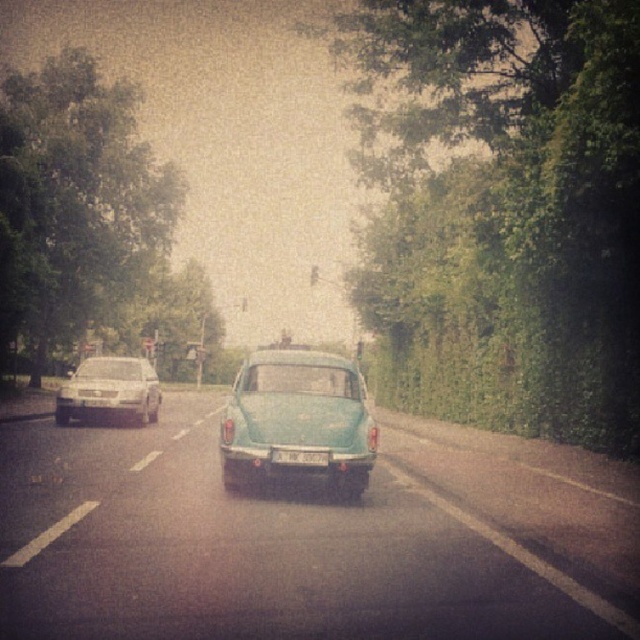
You are a delivery driver who needs to park your car in a space that can only accommodate vehicles up to the size of the white plastic license plate at center. Can the silver metallic sedan at left fit in this parking space?

The silver metallic sedan at left is wider than the white plastic license plate at center, so it cannot fit into the parking space designed for vehicles up to the size of the white plastic license plate at center.

Consider the image. You are a driver looking at the road ahead. You notice a green leafy wall at center and a white plastic license plate at center. Which object is wider?

The green leafy wall at center is wider than the white plastic license plate at center.

You are driving a car and see the silver metallic sedan at left and the white plastic license plate at center in your rearview mirror. Which object appears larger in the mirror?

The silver metallic sedan at left appears larger in the mirror because it is much taller than the white plastic license plate at center.